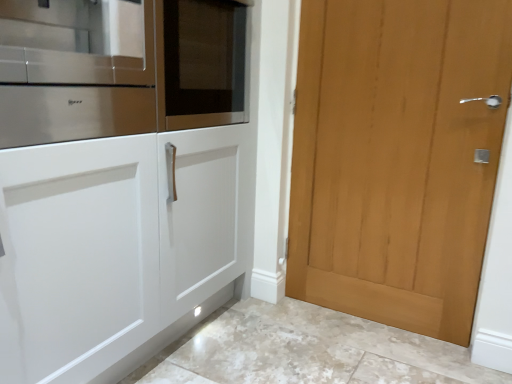
Question: In terms of size, does light brown wood door at right appear bigger or smaller than stainless steel oven at left?

Choices:
 (A) small
 (B) big

Answer: (B)

Question: Would you say light brown wood door at right is inside or outside stainless steel oven at left?

Choices:
 (A) outside
 (B) inside

Answer: (A)

Question: Estimate the real-world distances between objects in this image. Which object is farther from the light brown wood door at right?

Choices:
 (A) white marble floor at lower center
 (B) stainless steel oven at left

Answer: (B)

Question: Estimate the real-world distances between objects in this image. Which object is closer to the light brown wood door at right?

Choices:
 (A) white marble floor at lower center
 (B) stainless steel oven at left

Answer: (A)